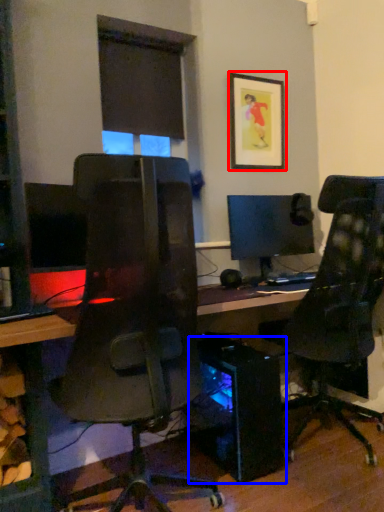
Question: Which object is further to the camera taking this photo, picture frame (highlighted by a red box) or computer tower (highlighted by a blue box)?

Choices:
 (A) picture frame
 (B) computer tower

Answer: (A)